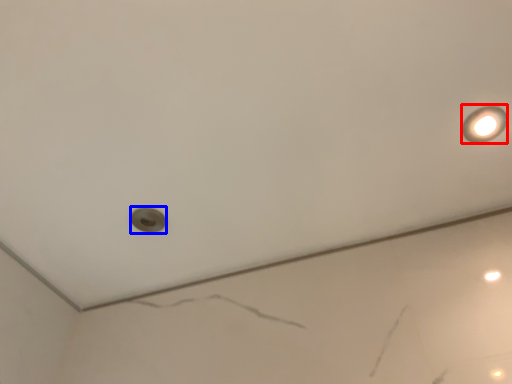
Question: Which of the following is the closest to the observer, light fixture (highlighted by a red box) or hole (highlighted by a blue box)?

Choices:
 (A) light fixture
 (B) hole

Answer: (A)